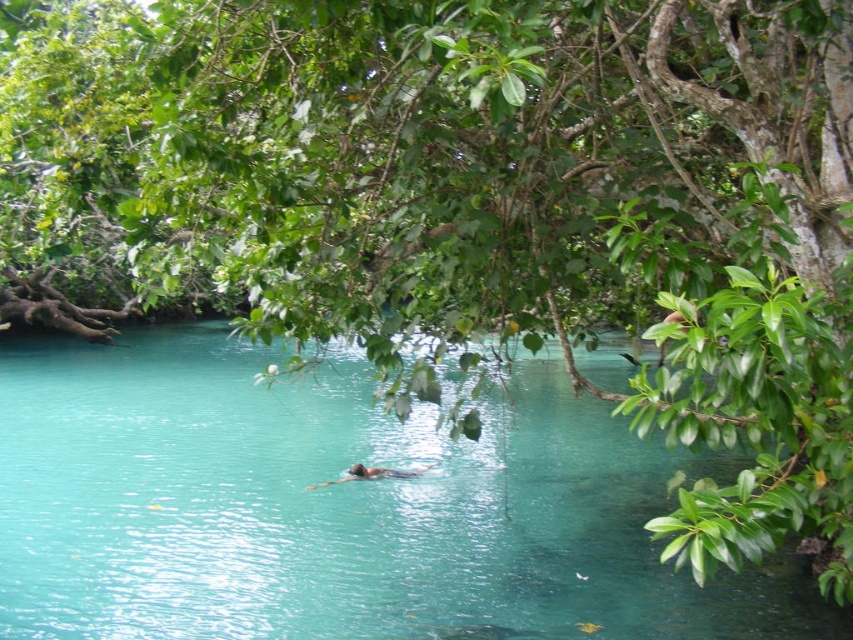
Is clear blue water at center smaller than smooth skin person at center?

Actually, clear blue water at center might be larger than smooth skin person at center.

Consider the image. Does clear blue water at center appear on the right side of smooth skin person at center?

No, clear blue water at center is not to the right of smooth skin person at center.

The image size is (853, 640). Identify the location of clear blue water at center. (338, 509).